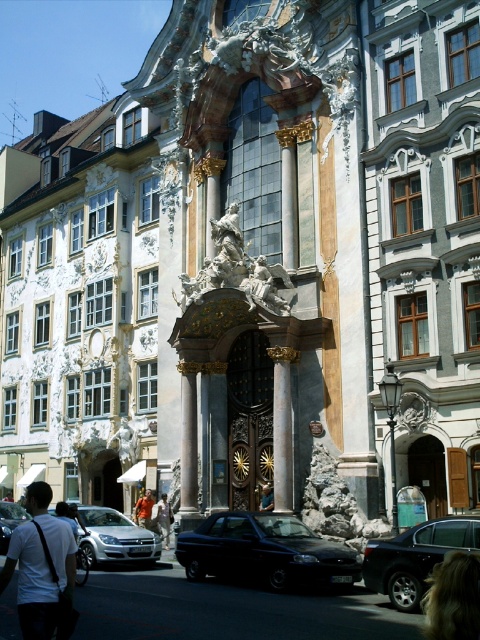
Does point (451, 568) come behind point (21, 515)?

No, (451, 568) is closer to viewer.

Does blonde hair at lower right lie in front of shiny silver sedan at center?

Yes, blonde hair at lower right is closer to the viewer.

Is point (454, 576) closer to camera compared to point (7, 512)?

Yes, point (454, 576) is closer to viewer.

Find the location of `blonde hair at lower right`. blonde hair at lower right is located at coordinates (453, 598).

Which of these two, white marble statue at center or white marble column at center, stands shorter?

white marble statue at center

Does point (184, 273) come farther from viewer compared to point (273, 349)?

Yes, it is.

At what (x,y) coordinates should I click in order to perform the action: click on white marble statue at center. Please return your answer as a coordinate pair (x, y). This screenshot has width=480, height=640. Looking at the image, I should click on (236, 269).

Which is more to the right, black matte car at center or light brown wooden door at center?

light brown wooden door at center

Can you confirm if black matte car at center is positioned to the left of light brown wooden door at center?

Yes, black matte car at center is to the left of light brown wooden door at center.

Where is `black matte car at center`? This screenshot has height=640, width=480. black matte car at center is located at coordinates (264, 552).